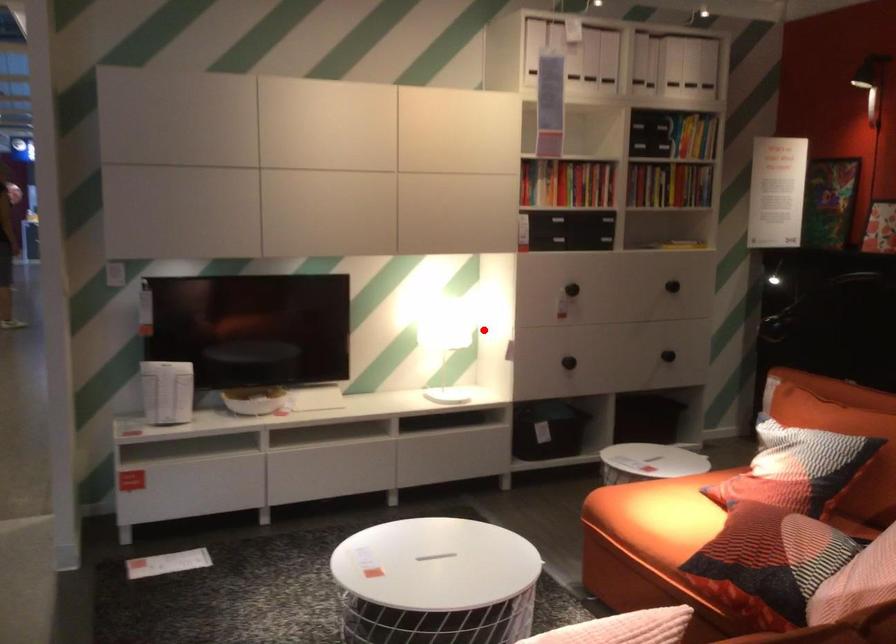
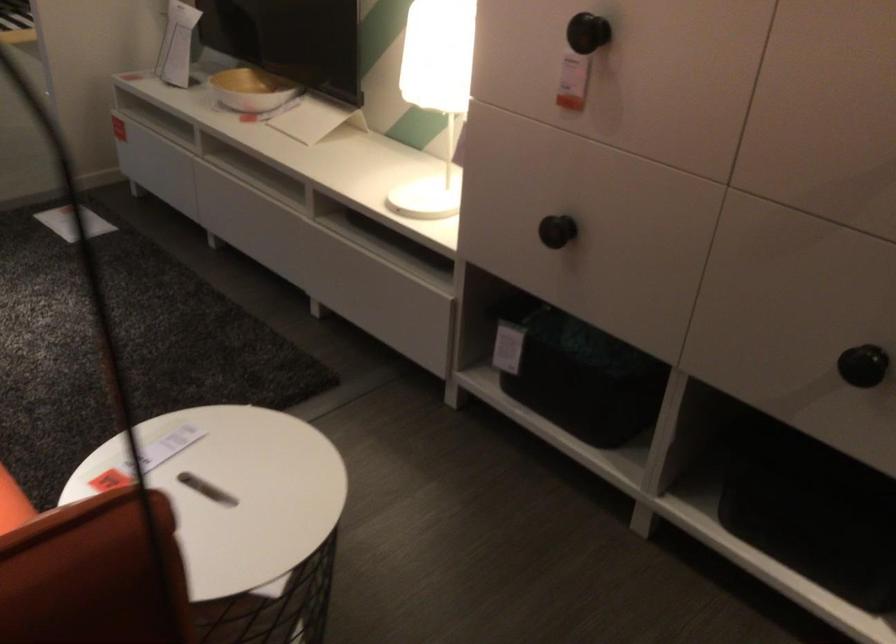
Question: A red point is marked in image1. In image2, is the corresponding 3D point closer to the camera or farther? Reply with the corresponding letter.

Choices:
 (A) The corresponding 3D point is closer.
 (B) The corresponding 3D point is farther.

Answer: (A)